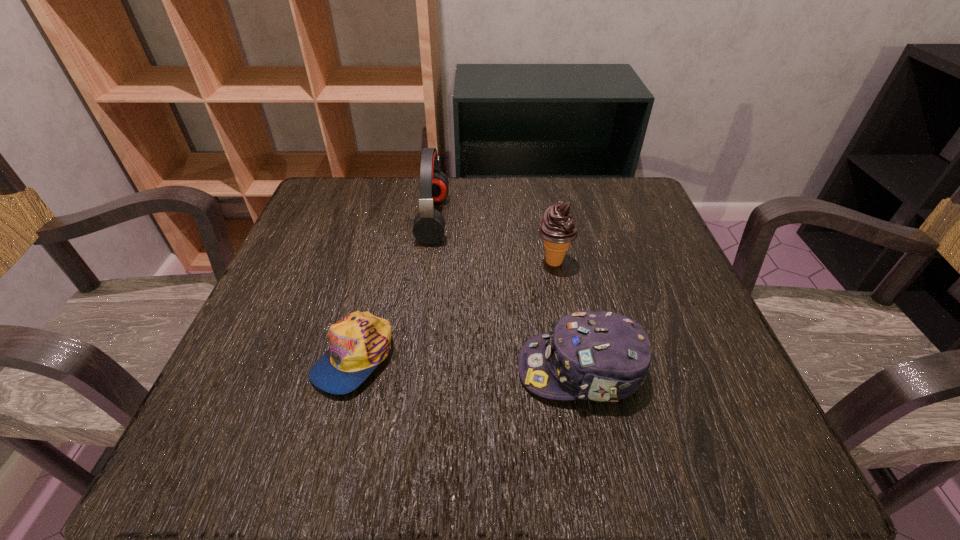
The height and width of the screenshot is (540, 960). I want to click on free space at the far left corner of the desktop, so click(372, 178).

I want to click on vacant space at the far right corner of the desktop, so click(628, 179).

At what (x,y) coordinates should I click in order to perform the action: click on free space that is in between the farthest object and the leftmost object. Please return your answer as a coordinate pair (x, y). Looking at the image, I should click on (394, 287).

Locate an element on the screen. The image size is (960, 540). vacant point located between the earphone and the second shortest object is located at coordinates (507, 294).

Find the location of `vacant space in between the farthest object and the icecream`. vacant space in between the farthest object and the icecream is located at coordinates (x=493, y=240).

At what (x,y) coordinates should I click in order to perform the action: click on vacant region between the shortest object and the icecream. Please return your answer as a coordinate pair (x, y). Looking at the image, I should click on (454, 309).

Locate an element on the screen. This screenshot has height=540, width=960. free spot between the farthest object and the taller cap is located at coordinates (507, 294).

I want to click on free space between the second farthest object and the farthest object, so click(x=493, y=240).

Locate an element on the screen. The image size is (960, 540). free point between the farthest object and the right cap is located at coordinates pyautogui.click(x=507, y=294).

Where is `vacant area that lies between the third nearest object and the shortest object`? This screenshot has height=540, width=960. vacant area that lies between the third nearest object and the shortest object is located at coordinates (454, 309).